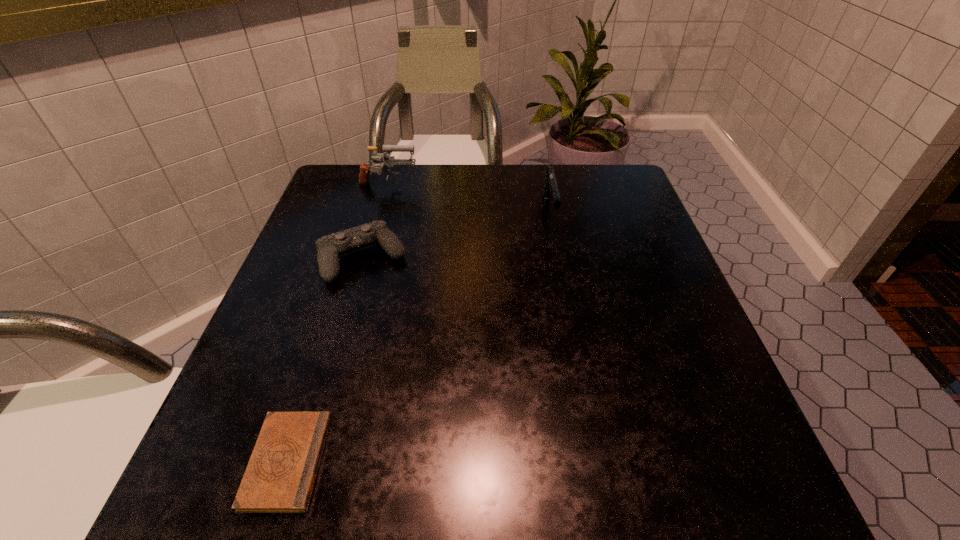
Identify the location of free space at the left edge of the desktop. (295, 319).

This screenshot has height=540, width=960. In order to click on free spot at the right edge of the desktop in this screenshot , I will do `click(659, 322)`.

Identify the location of free space at the far left corner of the desktop. (387, 177).

The width and height of the screenshot is (960, 540). In the image, there is a desktop. In order to click on vacant space at the near right corner in this screenshot , I will do `click(682, 487)`.

I want to click on free point between the diary and the tallest object, so click(x=338, y=323).

The image size is (960, 540). Find the location of `vacant space that is in between the shortest object and the second nearest object`. vacant space that is in between the shortest object and the second nearest object is located at coordinates (325, 360).

Identify the location of vacant space that's between the rightmost object and the third tallest object. (456, 234).

You are a GUI agent. You are given a task and a screenshot of the screen. Output one action in this format:
    pyautogui.click(x=<x>, y=<y>)
    Task: Click on the vacant space in between the control and the second tallest object
    
    Given the screenshot: What is the action you would take?
    pyautogui.click(x=456, y=234)

At what (x,y) coordinates should I click in order to perform the action: click on empty space that is in between the control and the shortest object. Please return your answer as a coordinate pair (x, y). This screenshot has width=960, height=540. Looking at the image, I should click on (325, 360).

The height and width of the screenshot is (540, 960). Identify the location of vacant space that's between the rightmost object and the diary. (419, 336).